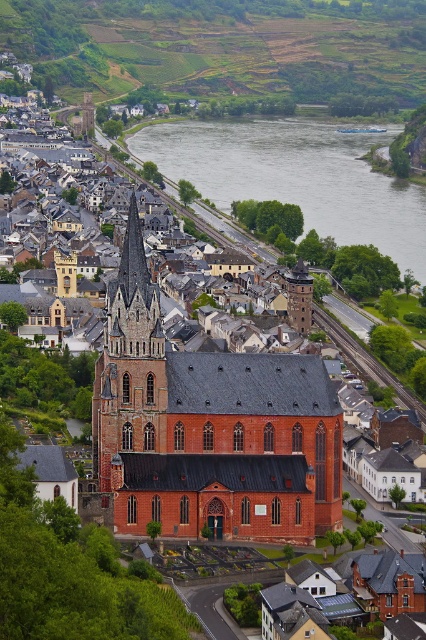
You are a tourist standing at the edge of the historic town, looking towards the river. You notice the red brick church at center and the green grassy hillside at upper center. Which of these two landmarks is located to the left when viewed from your perspective?

The red brick church at center is positioned on the left side of green grassy hillside at upper center, so from your perspective, the red brick church at center is to the left of the green grassy hillside at upper center.